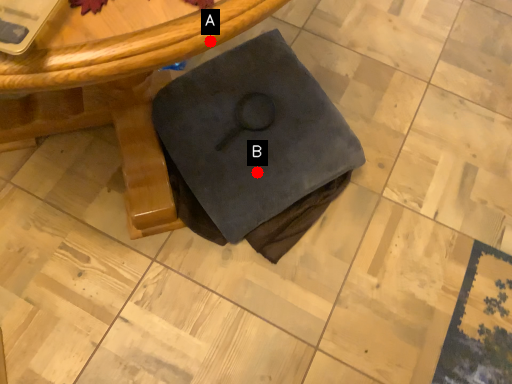
Question: Two points are circled on the image, labeled by A and B beside each circle. Which point is closer to the camera taking this photo?

Choices:
 (A) A is closer
 (B) B is closer

Answer: (A)